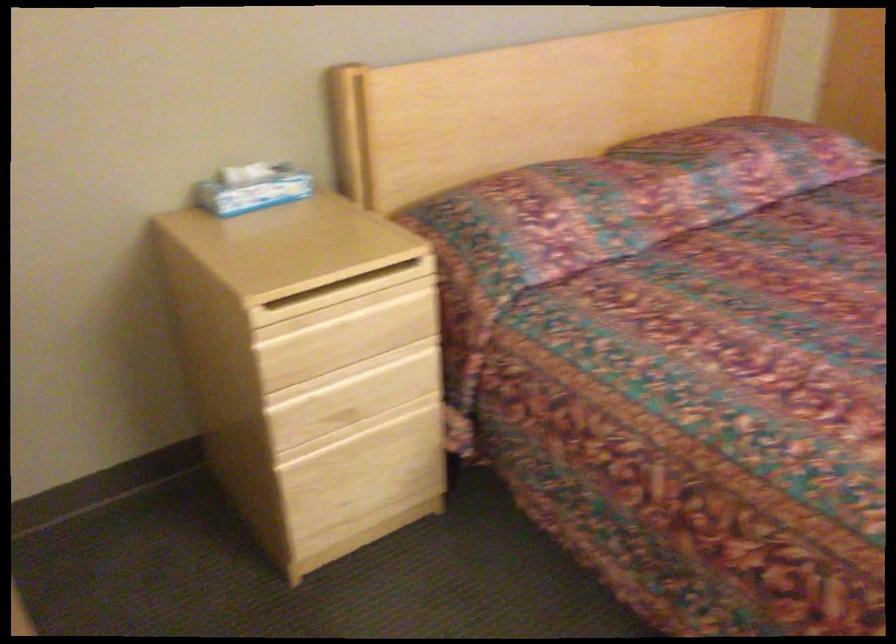
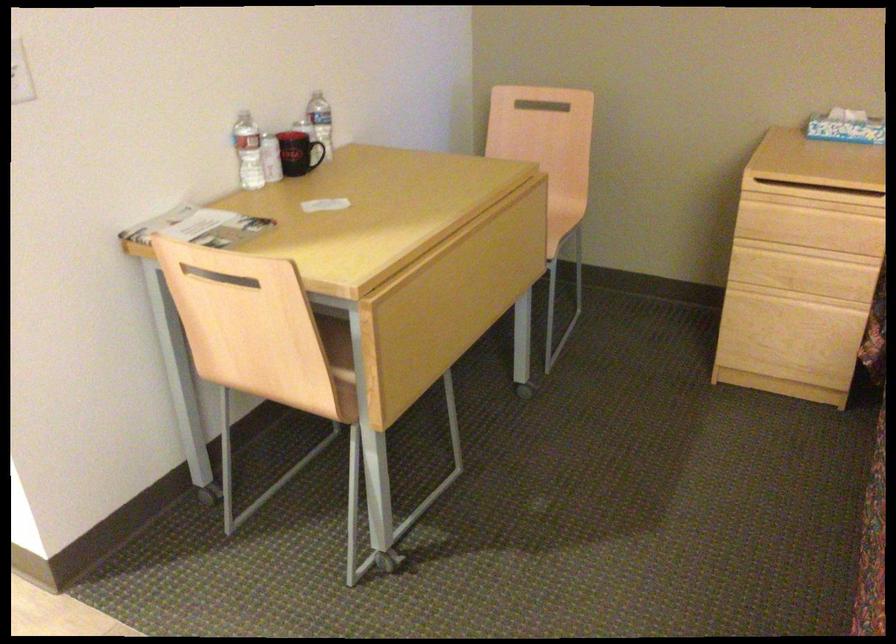
Locate, in the second image, the point that corresponds to (340,301) in the first image.

(814, 196)